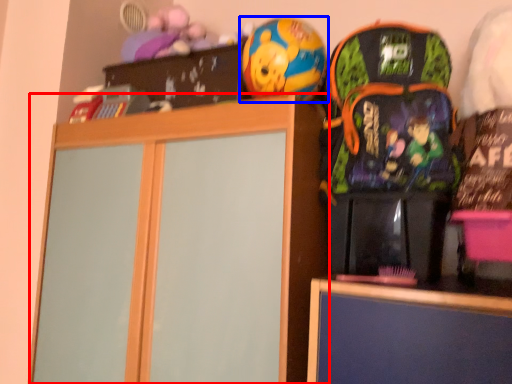
Question: Which object appears closest to the camera in this image, cabinetry (highlighted by a red box) or toy (highlighted by a blue box)?

Choices:
 (A) cabinetry
 (B) toy

Answer: (A)